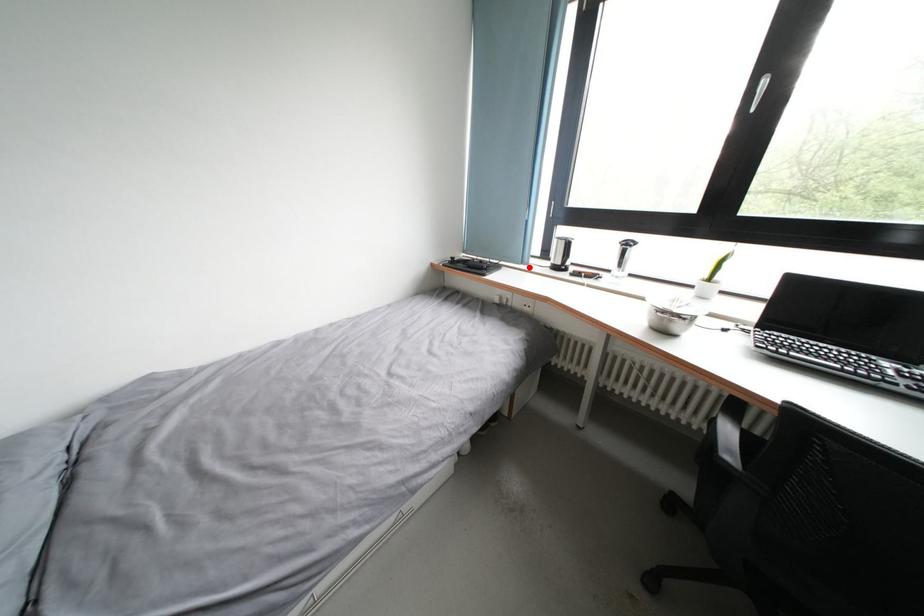
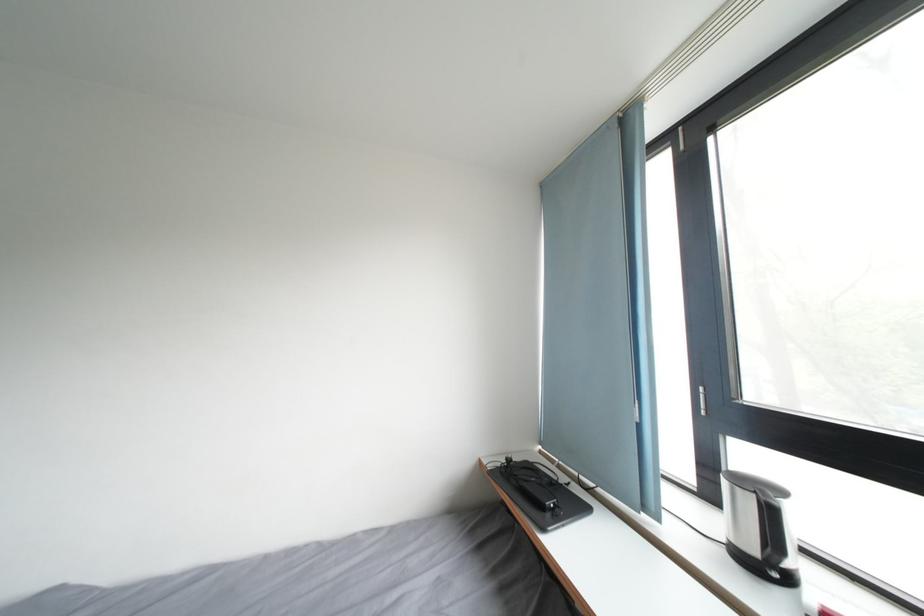
Where in the second image is the point corresponding to the highlighted location from the first image?

(651, 514)